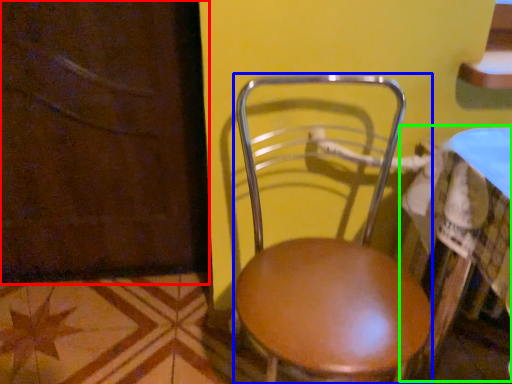
Question: Which object is positioned farthest from screen door (highlighted by a red box)? Select from chair (highlighted by a blue box) and table (highlighted by a green box).

Choices:
 (A) chair
 (B) table

Answer: (B)